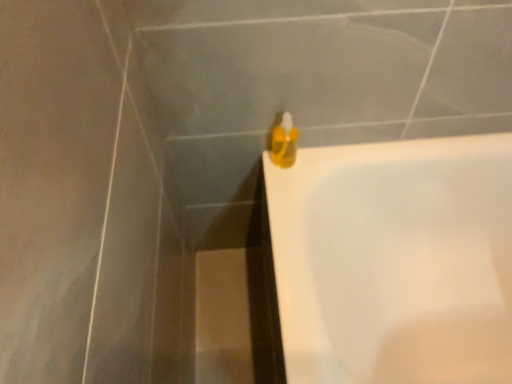
Question: From a real-world perspective, is translucent yellow liquid at upper right above or below white glossy bathtub at upper right?

Choices:
 (A) below
 (B) above

Answer: (B)

Question: From the image's perspective, is translucent yellow liquid at upper right positioned above or below white glossy bathtub at upper right?

Choices:
 (A) above
 (B) below

Answer: (A)

Question: Looking at their shapes, would you say translucent yellow liquid at upper right is wider or thinner than white glossy bathtub at upper right?

Choices:
 (A) wide
 (B) thin

Answer: (B)

Question: From a real-world perspective, relative to translucent yellow liquid at upper right, is white glossy bathtub at upper right vertically above or below?

Choices:
 (A) above
 (B) below

Answer: (B)

Question: From the image's perspective, is white glossy bathtub at upper right positioned above or below translucent yellow liquid at upper right?

Choices:
 (A) below
 (B) above

Answer: (A)

Question: Is white glossy bathtub at upper right bigger or smaller than translucent yellow liquid at upper right?

Choices:
 (A) big
 (B) small

Answer: (A)

Question: Considering their positions, is white glossy bathtub at upper right located in front of or behind translucent yellow liquid at upper right?

Choices:
 (A) front
 (B) behind

Answer: (A)